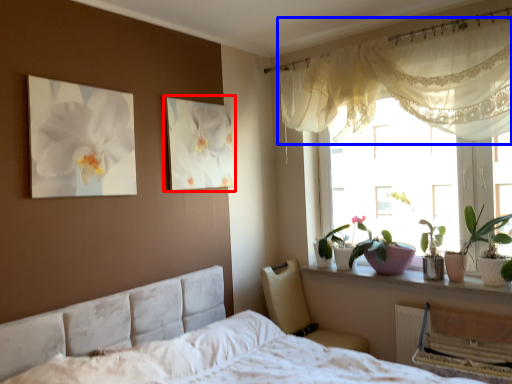
Question: Which object appears closest to the camera in this image, picture frame (highlighted by a red box) or curtain (highlighted by a blue box)?

Choices:
 (A) picture frame
 (B) curtain

Answer: (B)